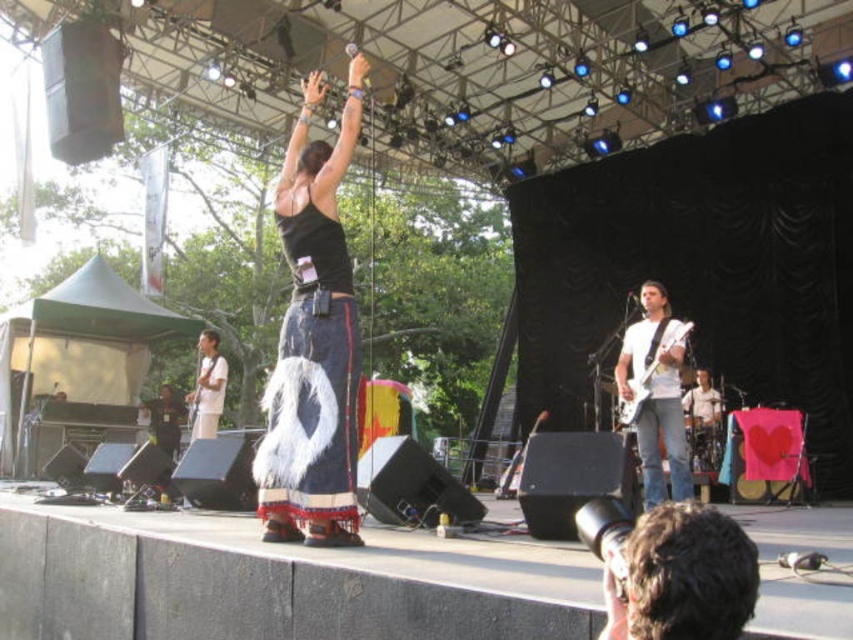
You are standing at point (280, 388) and want to take a photo of the performer on stage. The camera you have is 15 feet away from you. Can you reach the camera in time to capture the performer?

The distance between you and the camera is 15.37 feet, which is slightly more than the 15 feet your camera can reach. Therefore, you cannot capture the performer with your current camera range.